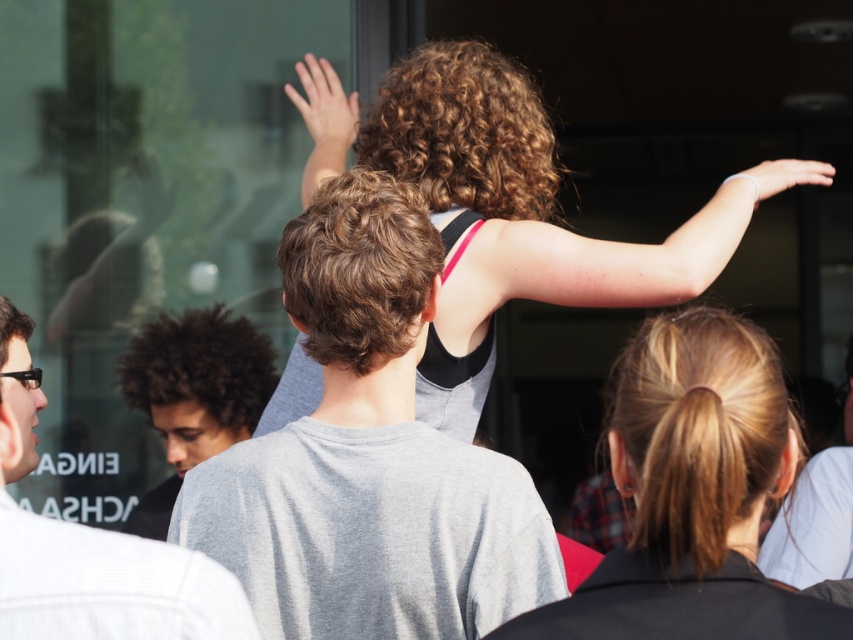
Question: Among these objects, which one is nearest to the camera?

Choices:
 (A) transparent glass door at upper left
 (B) curly-haired person at center
 (C) light gray t-shirt at center
 (D) dark brown curly hair at center

Answer: (D)

Question: Estimate the real-world distances between objects in this image. Which object is farther from the dark brown curly hair at lower left?

Choices:
 (A) blonde hair at center
 (B) curly-haired person at center
 (C) smooth skin hand at upper center
 (D) white matte hand at upper right

Answer: (A)

Question: Where is blonde hair at center located in relation to light gray t-shirt at center in the image?

Choices:
 (A) right
 (B) left

Answer: (B)

Question: Is curly-haired person at center wider than blonde hair at center?

Choices:
 (A) no
 (B) yes

Answer: (B)

Question: Which point is closer to the camera taking this photo?

Choices:
 (A) (316, 102)
 (B) (453, 154)

Answer: (B)

Question: Can you confirm if blonde hair at center is thinner than dark brown curly hair at center?

Choices:
 (A) no
 (B) yes

Answer: (B)